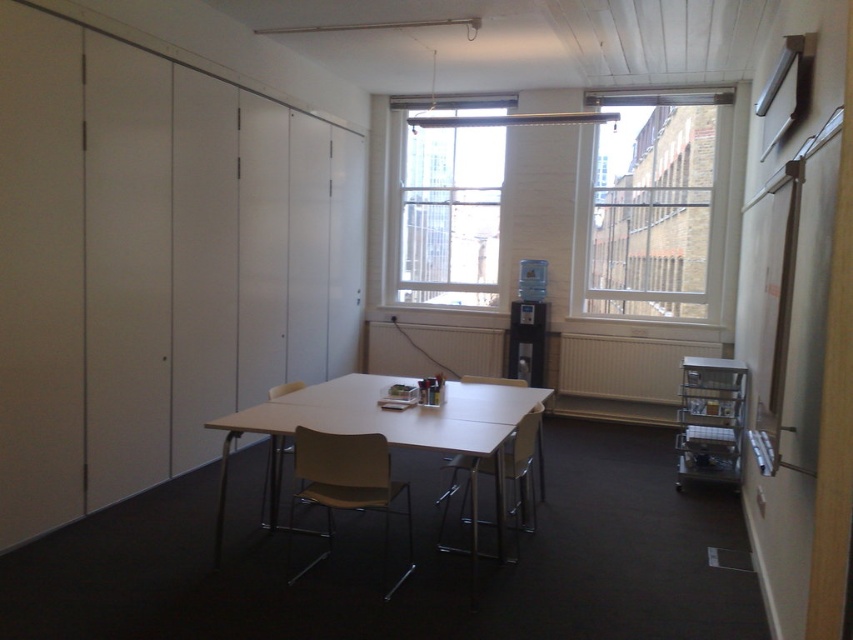
Question: In this image, where is clear glass window at upper center located relative to beige plastic chair at center?

Choices:
 (A) right
 (B) left

Answer: (A)

Question: Does clear glass window at upper center appear on the left side of matte beige chair at center?

Choices:
 (A) no
 (B) yes

Answer: (A)

Question: Based on their relative distances, which object is farther from the beige plastic chair at center?

Choices:
 (A) clear glass window at upper center
 (B) light brown plastic chair at center

Answer: (A)

Question: Does clear glass window at center have a smaller size compared to matte beige chair at center?

Choices:
 (A) yes
 (B) no

Answer: (B)

Question: Which of the following is the closest to the observer?

Choices:
 (A) (352, 397)
 (B) (387, 522)
 (C) (427, 109)

Answer: (A)

Question: Which point appears closest to the camera in this image?

Choices:
 (A) (357, 438)
 (B) (474, 460)

Answer: (A)